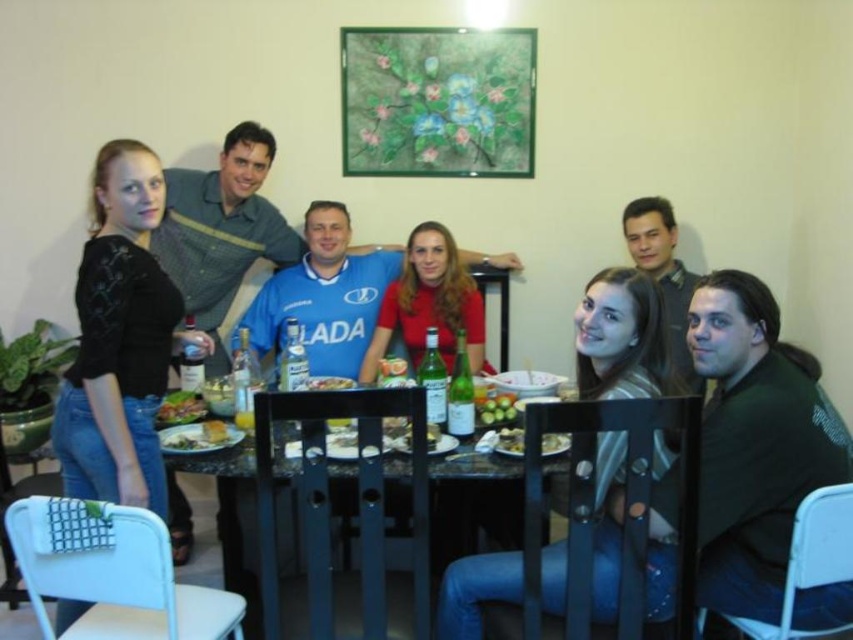
You are a server who needs to place a 10cm tall dessert plate on the table without it tipping over. Considering the black glass table at center and the green matte grapes at center, which object should you place the dessert plate on?

The black glass table at center is much taller than the green matte grapes at center, so placing the dessert plate on the black glass table at center will ensure stability and prevent tipping.

You are a guest at this dinner and want to reach for the green leafy salad at center. Which direction should you move relative to your current position at point (509, 442)?

The point (509, 442) is where the green leafy salad at center is located, so you are already at the salad.